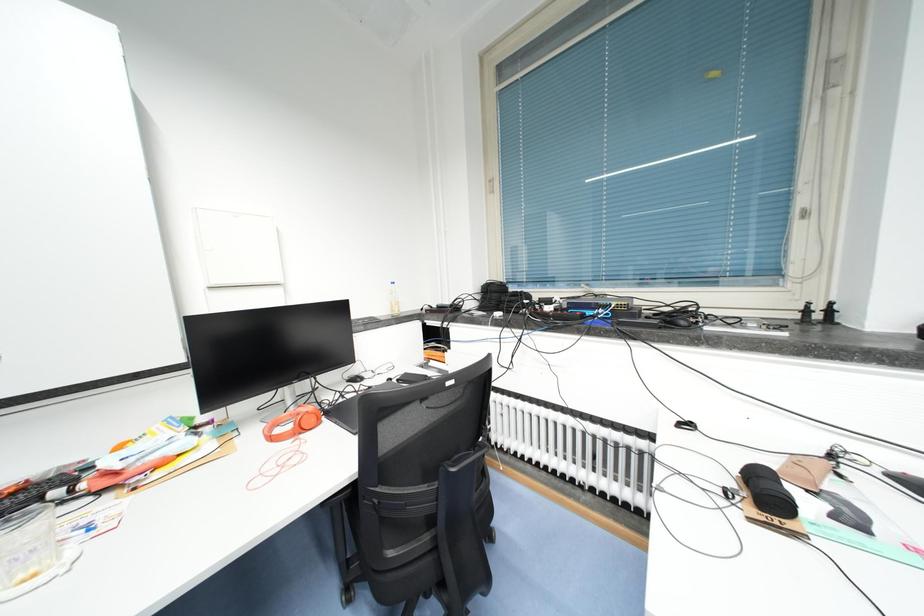
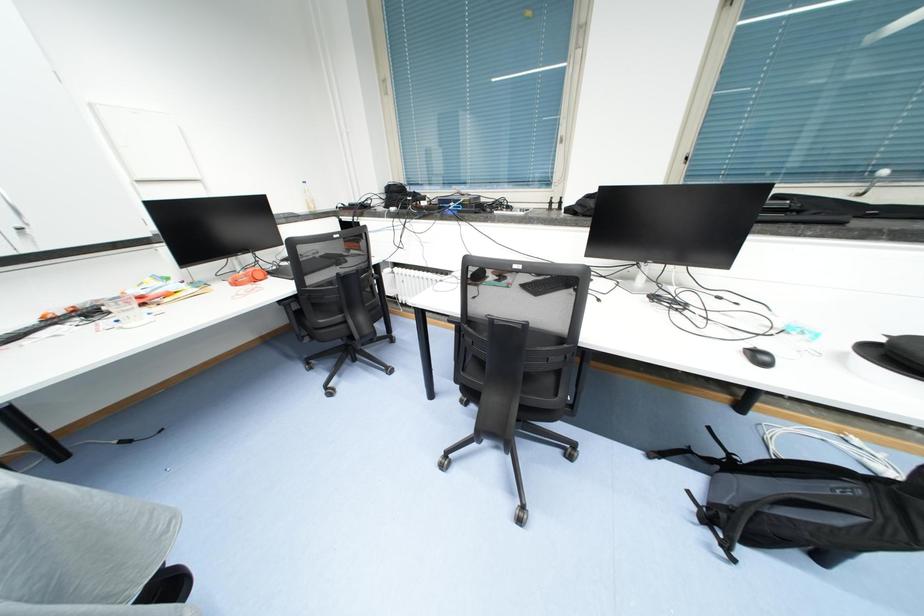
In a continuous first-person perspective shot, in which direction is the camera moving?

The movement direction of the cameraman is right, backward.